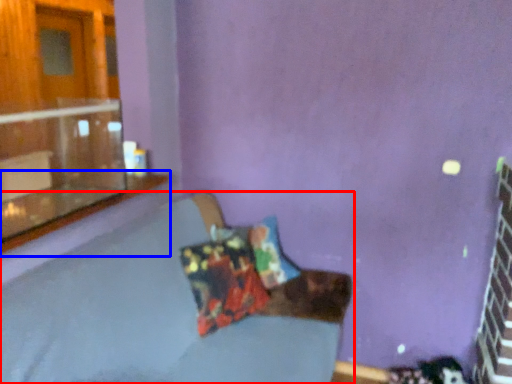
Question: Which point is closer to the camera, studio couch (highlighted by a red box) or window sill (highlighted by a blue box)?

Choices:
 (A) studio couch
 (B) window sill

Answer: (A)